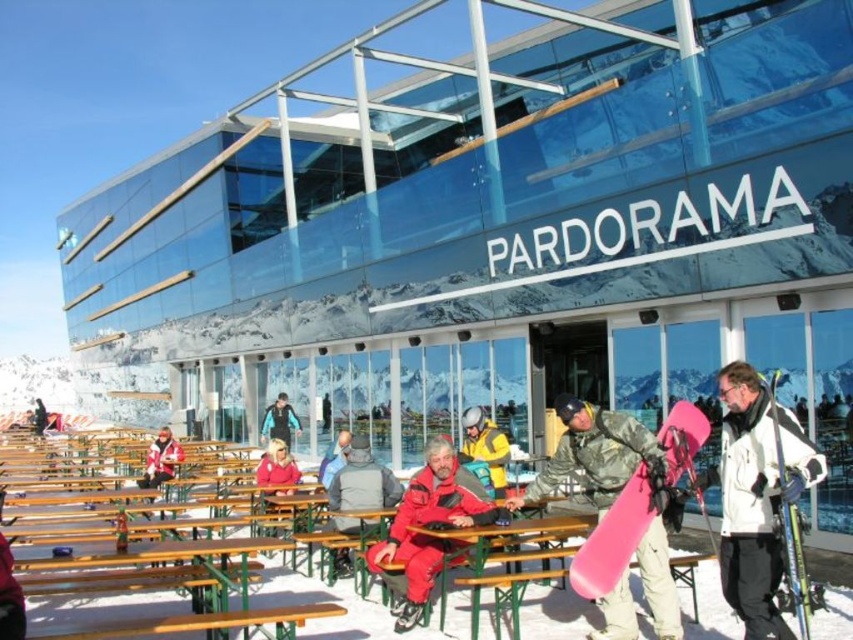
Question: Observing the image, what is the correct spatial positioning of matte red ski suit at center in reference to matte yellow jacket at center?

Choices:
 (A) above
 (B) below

Answer: (B)

Question: Estimate the real-world distances between objects in this image. Which object is closer to the yellow matte jacket at center?

Choices:
 (A) dark blue jacket at center
 (B) pink matte snowboard at center

Answer: (B)

Question: Is green wooden table at center bigger than matte red jacket at center?

Choices:
 (A) yes
 (B) no

Answer: (B)

Question: Can you confirm if white matte jacket at center is positioned to the right of yellow matte jacket at center?

Choices:
 (A) yes
 (B) no

Answer: (A)

Question: Which point is farther from the camera taking this photo?

Choices:
 (A) (158, 476)
 (B) (500, 477)
 (C) (280, 408)
 (D) (378, 490)

Answer: (C)

Question: Which point is closer to the camera taking this photo?

Choices:
 (A) (605, 528)
 (B) (170, 465)
 (C) (38, 424)
 (D) (273, 433)

Answer: (A)